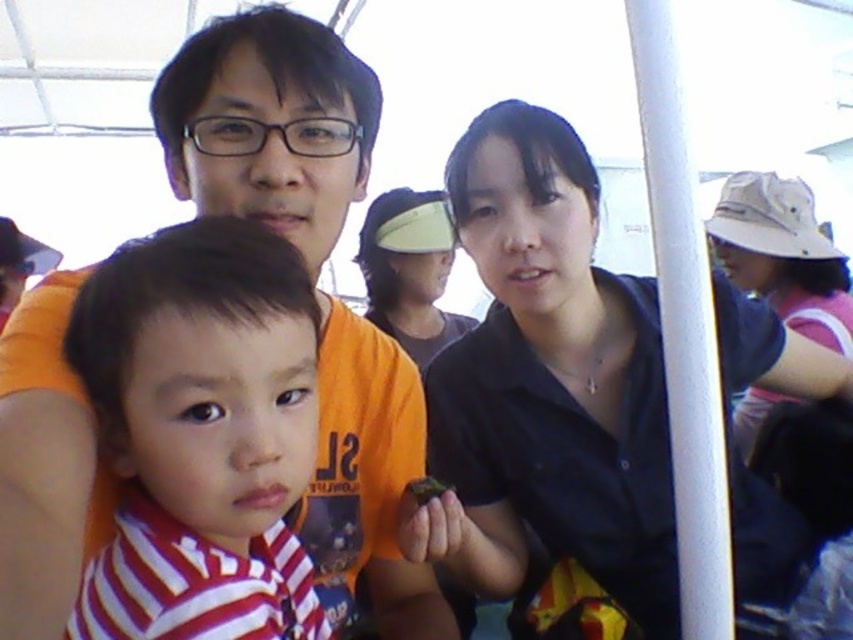
Question: Is black matte shirt at center thinner than striped fabric shirt at center?

Choices:
 (A) no
 (B) yes

Answer: (A)

Question: In this image, where is black matte shirt at center located relative to beige fabric hat at upper right?

Choices:
 (A) below
 (B) above

Answer: (A)

Question: Which of the following is the farthest from the observer?

Choices:
 (A) beige fabric hat at upper right
 (B) striped fabric shirt at center
 (C) orange matte shirt at center

Answer: (A)

Question: Among these points, which one is farthest from the camera?

Choices:
 (A) (462, 560)
 (B) (331, 392)
 (C) (189, 465)
 (D) (370, 224)

Answer: (D)

Question: Is striped fabric shirt at center wider than matte yellow visor at center?

Choices:
 (A) yes
 (B) no

Answer: (B)

Question: Which of the following is the farthest from the observer?

Choices:
 (A) (821, 324)
 (B) (337, 586)

Answer: (A)